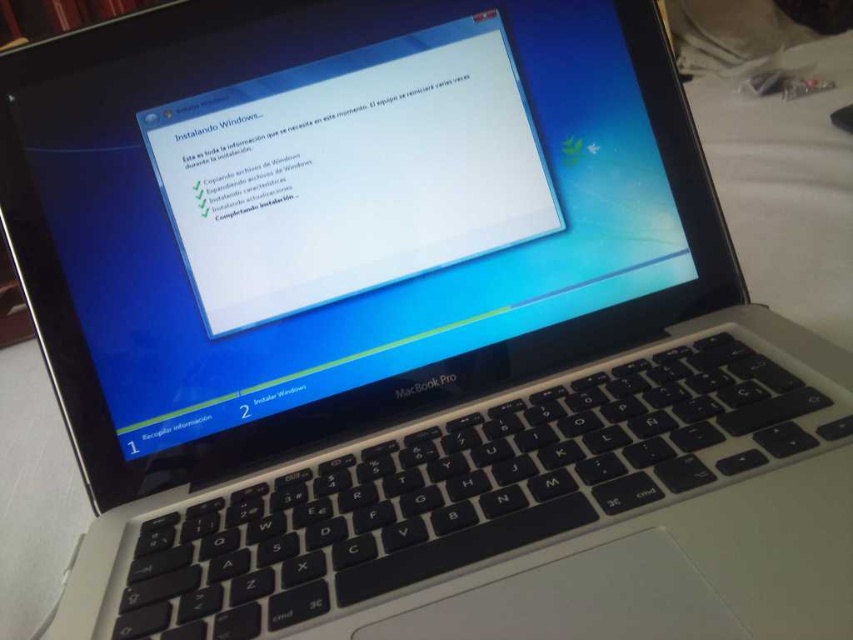
Question: Can you confirm if white glossy screen at center is positioned to the right of white fabric at lower right?

Choices:
 (A) no
 (B) yes

Answer: (A)

Question: Which object is closer to the camera taking this photo?

Choices:
 (A) white fabric at lower right
 (B) white glossy screen at center

Answer: (B)

Question: Which point is farther from the camera taking this photo?

Choices:
 (A) (833, 314)
 (B) (236, 205)

Answer: (A)

Question: Where is white glossy screen at center located in relation to white fabric at lower right in the image?

Choices:
 (A) below
 (B) above

Answer: (A)

Question: Does white glossy screen at center have a lesser width compared to white fabric at lower right?

Choices:
 (A) yes
 (B) no

Answer: (A)